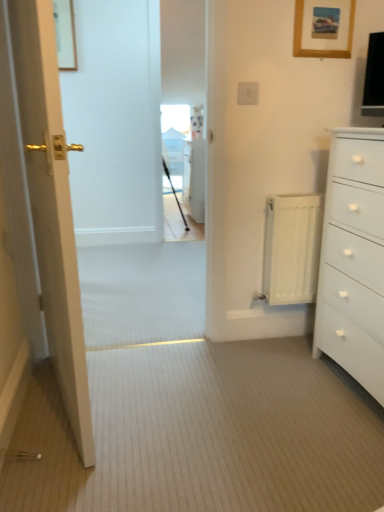
Question: Is white matte chest of drawers at right spatially inside white plastic electric outlet at upper center, or outside of it?

Choices:
 (A) inside
 (B) outside

Answer: (B)

Question: From a real-world perspective, is white matte chest of drawers at right positioned above or below white plastic electric outlet at upper center?

Choices:
 (A) above
 (B) below

Answer: (B)

Question: Which object is the farthest from the white metallic radiator at right?

Choices:
 (A) matte gold door at left
 (B) wooden picture frame at upper right, the second picture frame viewed from the top
 (C) white plastic electric outlet at upper center
 (D) wooden picture frame at upper left, arranged as the 1th picture frame when viewed from the top
 (E) white matte chest of drawers at right

Answer: (D)

Question: Estimate the real-world distances between objects in this image. Which object is farther from the wooden picture frame at upper left, the second picture frame in the bottom-to-top sequence?

Choices:
 (A) white plastic electric outlet at upper center
 (B) white metallic radiator at right
 (C) white matte chest of drawers at right
 (D) wooden picture frame at upper right, placed as the 1th picture frame when sorted from front to back
 (E) matte gold door at left

Answer: (C)